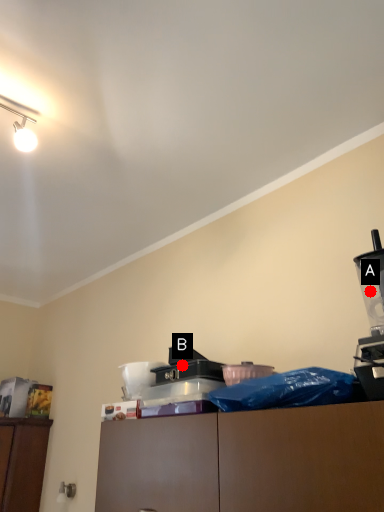
Question: Two points are circled on the image, labeled by A and B beside each circle. Which of the following is the closest to the observer?

Choices:
 (A) A is closer
 (B) B is closer

Answer: (A)